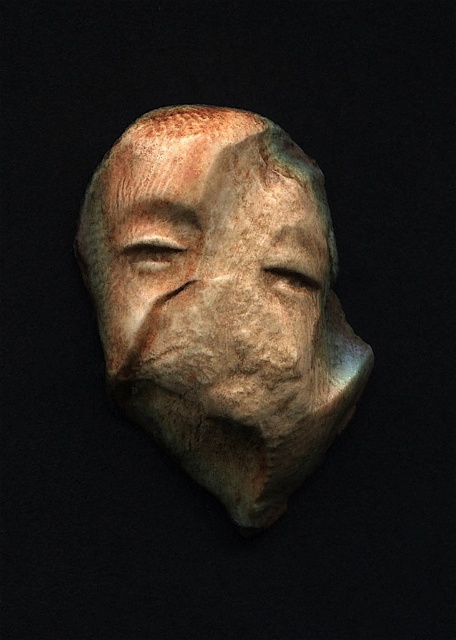
You are an art conservator examining the matte stone mask at center. Based on its coordinates, where exactly is the mask positioned within the image?

The matte stone mask at center is precisely located at the coordinates point (x=222, y=300).

You are an art conservator examining a sculpture. You need to place a protective cover over the sculpture. The cover must be centered precisely at point (x=222, y=300). Which part of the sculpture should you aim for to ensure the cover is correctly positioned?

The matte stone mask at center is located at point (x=222, y=300), so you should aim for the matte stone mask at center to ensure the cover is correctly positioned.

You are an art restorer examining the sculpture. You notice two features at the center of the sculpture. One is the matte stone mask at center and the other is the matte stone face at center. Which one is positioned lower?

The matte stone mask at center is below the matte stone face at center, so the matte stone mask at center is positioned lower.